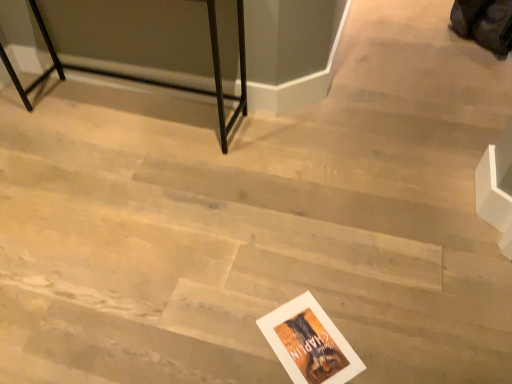
Question: Is white paper postcard at lower center situated inside black metal table at upper left or outside?

Choices:
 (A) inside
 (B) outside

Answer: (B)

Question: From a real-world perspective, is white paper postcard at lower center above or below black metal table at upper left?

Choices:
 (A) above
 (B) below

Answer: (B)

Question: Considering their positions, is white paper postcard at lower center located in front of or behind black metal table at upper left?

Choices:
 (A) behind
 (B) front

Answer: (B)

Question: In terms of size, does black metal table at upper left appear bigger or smaller than white paper postcard at lower center?

Choices:
 (A) small
 (B) big

Answer: (B)

Question: Choose the correct answer: Is black metal table at upper left inside white paper postcard at lower center or outside it?

Choices:
 (A) outside
 (B) inside

Answer: (A)

Question: From the image's perspective, is black metal table at upper left positioned above or below white paper postcard at lower center?

Choices:
 (A) below
 (B) above

Answer: (B)

Question: Is black metal table at upper left wider or thinner than white paper postcard at lower center?

Choices:
 (A) wide
 (B) thin

Answer: (A)